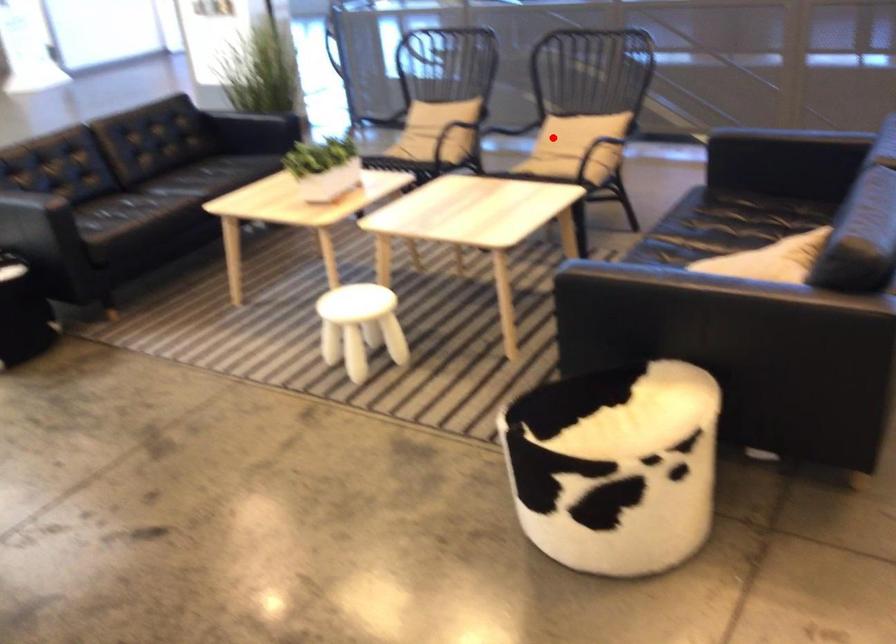
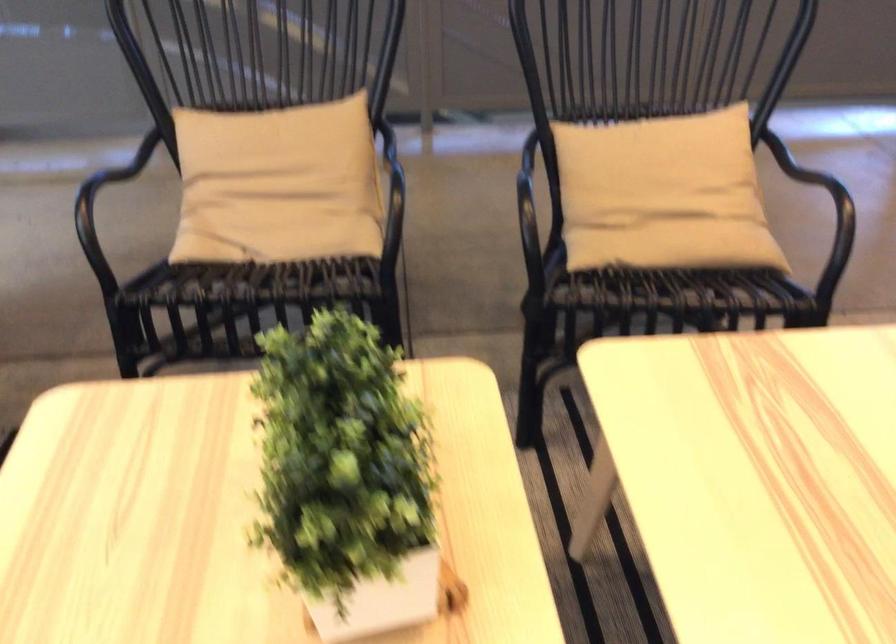
The point at the highlighted location is marked in the first image. Where is the corresponding point in the second image?

(662, 194)